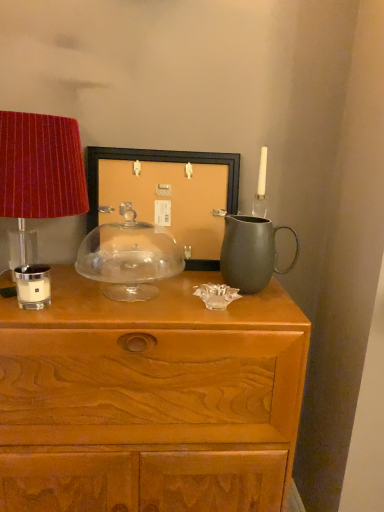
Identify the location of spots to the right of white matte candle holder at left, marked as the 2th candle holder in a back-to-front arrangement. The image size is (384, 512). (102, 303).